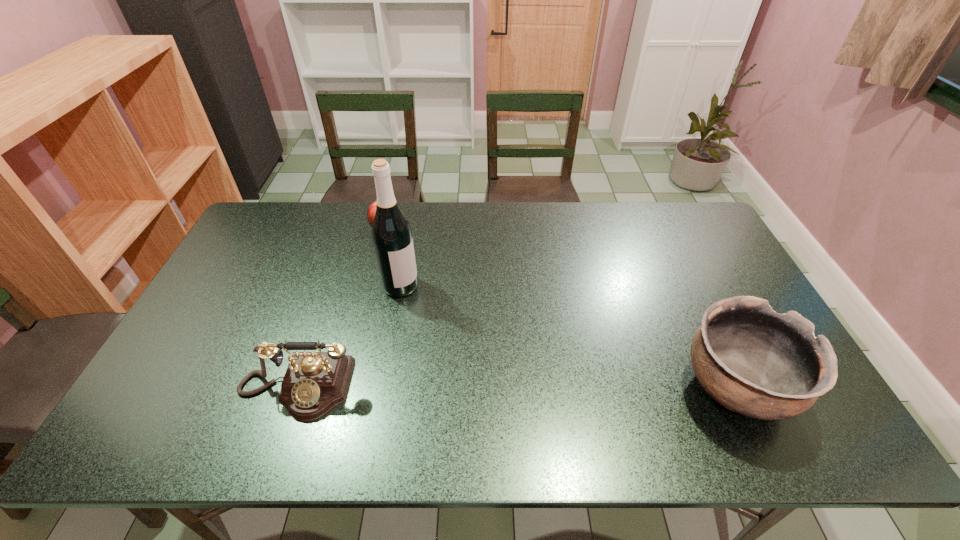
Find the location of a particular element. The width and height of the screenshot is (960, 540). free spot on the desktop that is between the second shortest object and the rightmost object and is positioned on the label of the third nearest object is located at coordinates (542, 388).

You are a GUI agent. You are given a task and a screenshot of the screen. Output one action in this format:
    pyautogui.click(x=<x>, y=<y>)
    Task: Click on the free space on the desktop that is between the telephone and the pottery and is positioned on the bitten side of the farthest object
    The height and width of the screenshot is (540, 960).
    Given the screenshot: What is the action you would take?
    pyautogui.click(x=457, y=388)